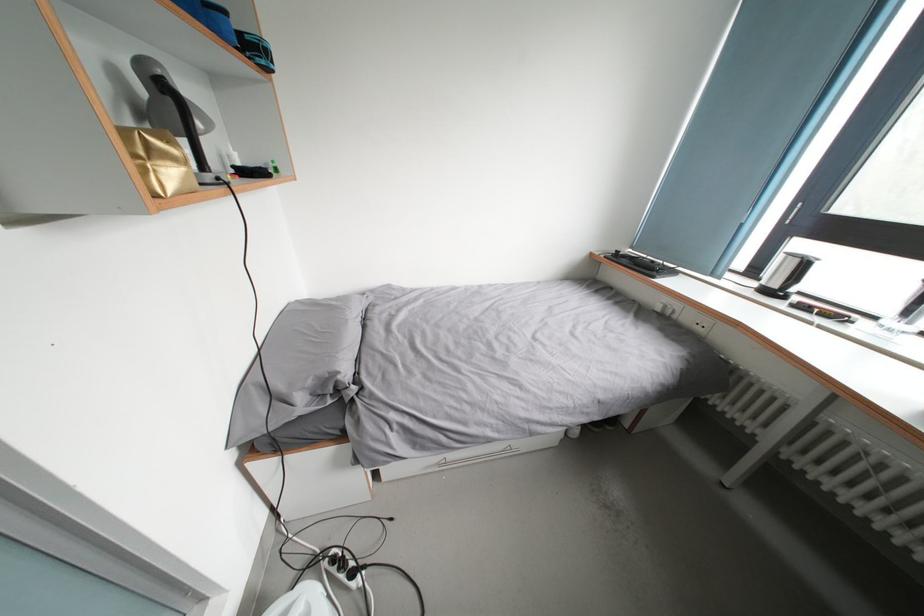
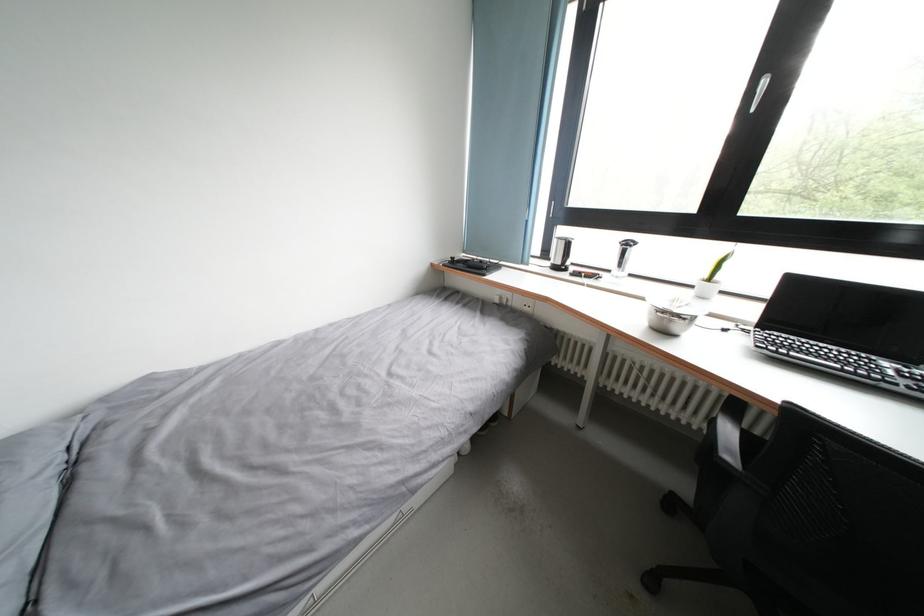
Question: The camera is either moving clockwise (left) or counter-clockwise (right) around the object. The first image is from the beginning of the video and the second image is from the end. Is the camera moving left or right when shooting the video?

Choices:
 (A) Left
 (B) Right

Answer: (A)